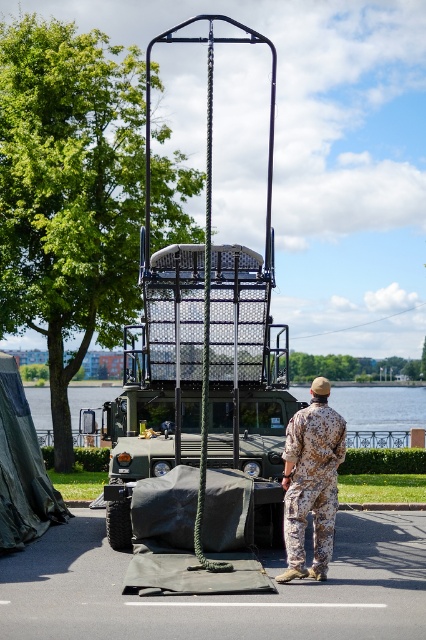
Question: Is camouflage fabric uniform at center to the right of green water at center from the viewer's perspective?

Choices:
 (A) no
 (B) yes

Answer: (B)

Question: Can you confirm if camouflage fabric uniform at center is positioned to the right of green water at center?

Choices:
 (A) no
 (B) yes

Answer: (B)

Question: Among these points, which one is nearest to the camera?

Choices:
 (A) (299, 531)
 (B) (48, 428)

Answer: (A)

Question: Is camouflage fabric uniform at center thinner than green water at center?

Choices:
 (A) no
 (B) yes

Answer: (B)